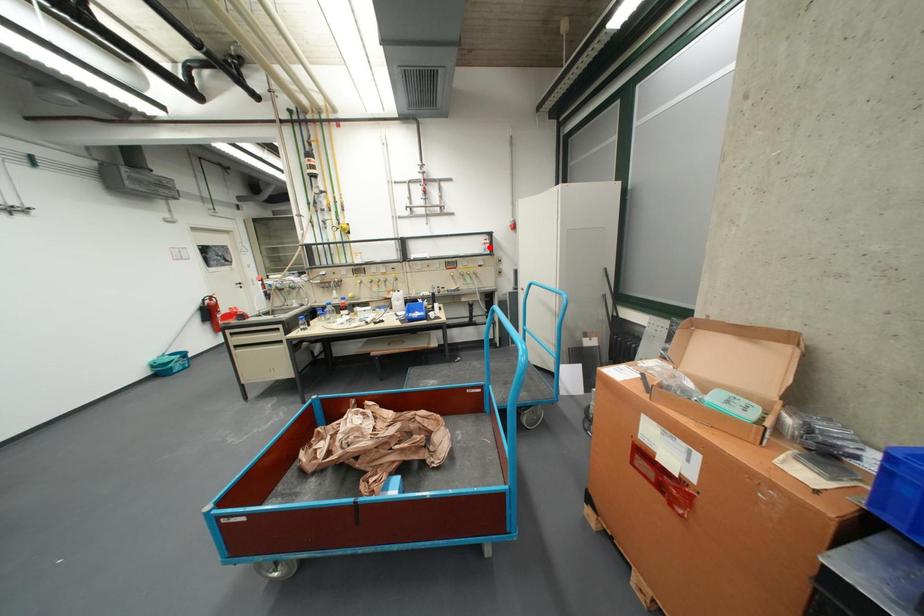
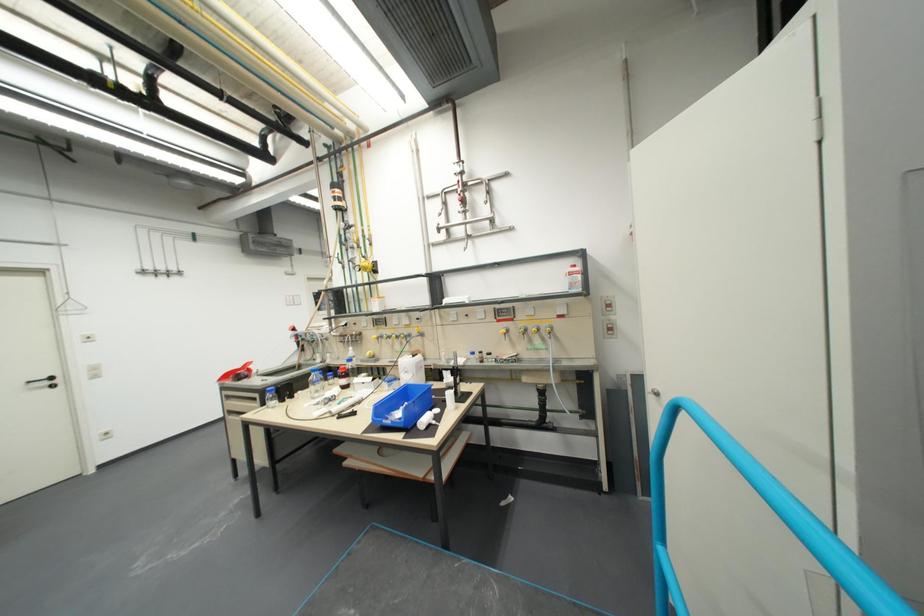
Question: I am providing you with two images of the same scene from different viewpoints. Given a red point in image1, look at the same physical point in image2. Is it:

Choices:
 (A) Closer to the viewpoint
 (B) Farther from the viewpoint

Answer: (B)